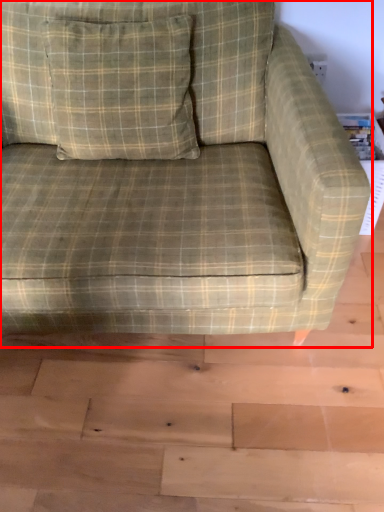
Question: From the image's perspective, where is studio couch (annotated by the red box) located in relation to throw pillow in the image?

Choices:
 (A) below
 (B) above

Answer: (A)